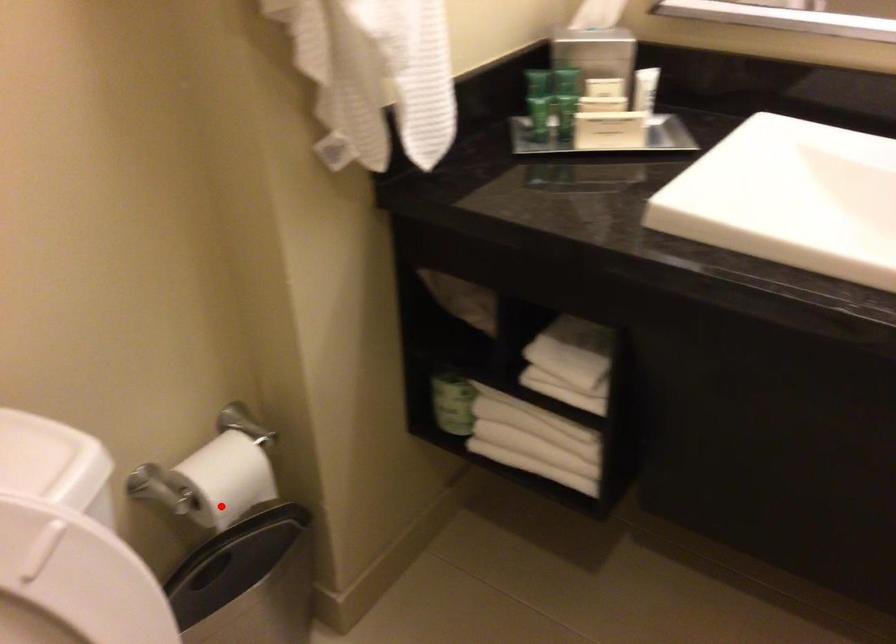
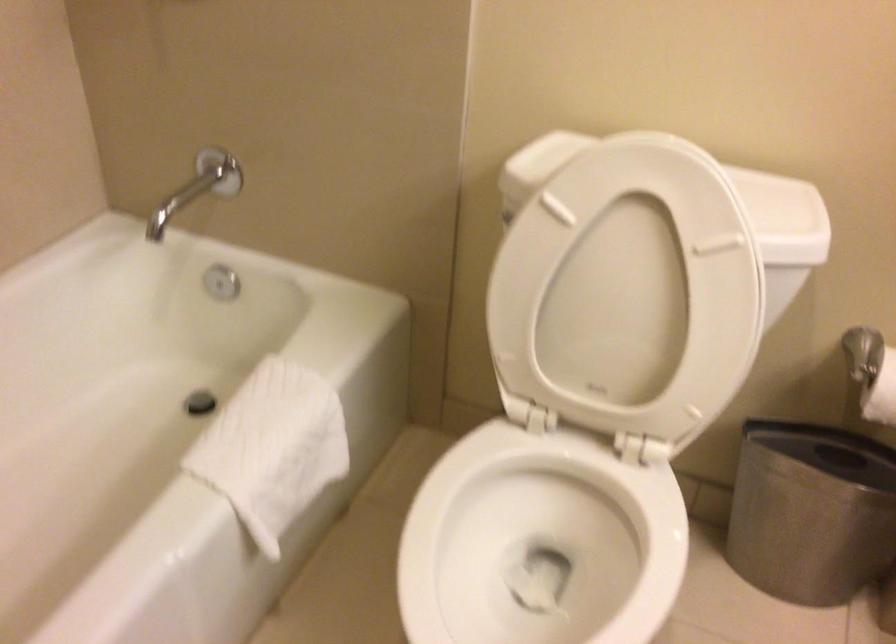
In the second image, find the point that corresponds to the highlighted location in the first image.

(881, 393)